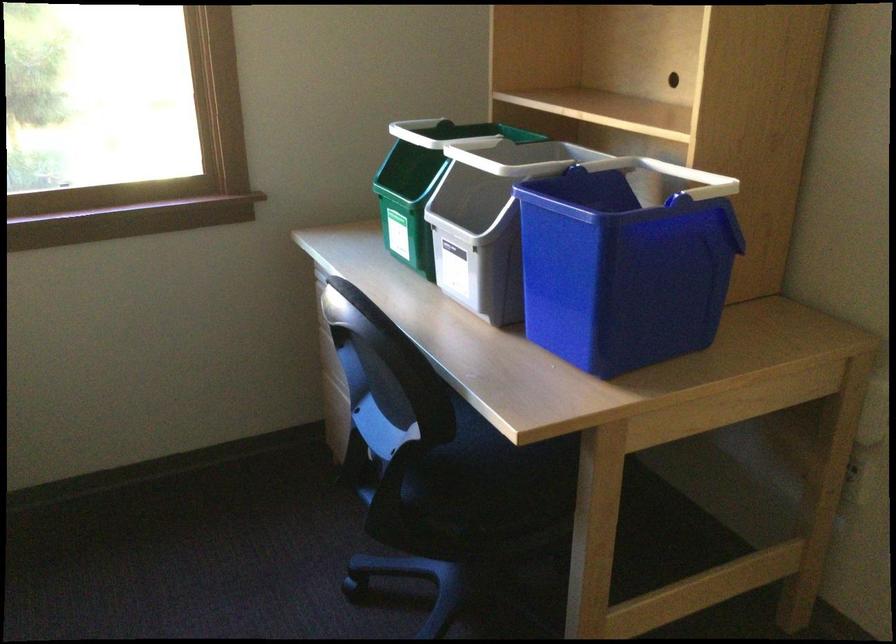
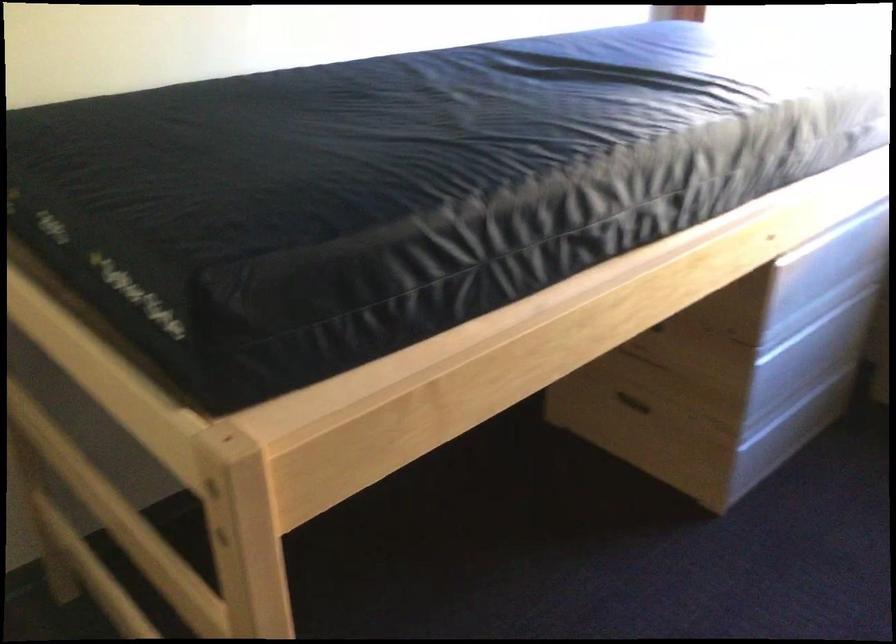
First-person continuous shooting, in which direction is the camera rotating?

The camera rotated toward left-down.